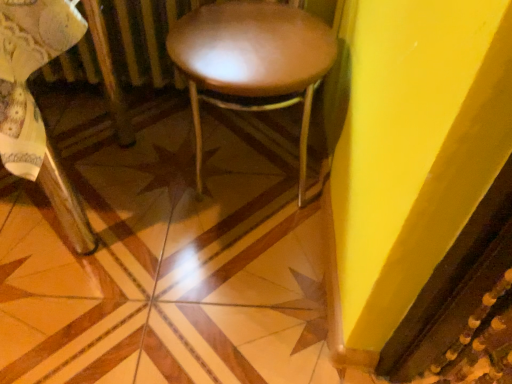
Locate an element on the screen. The width and height of the screenshot is (512, 384). vacant space underneath wooden chair at center (from a real-world perspective) is located at coordinates coord(81,191).